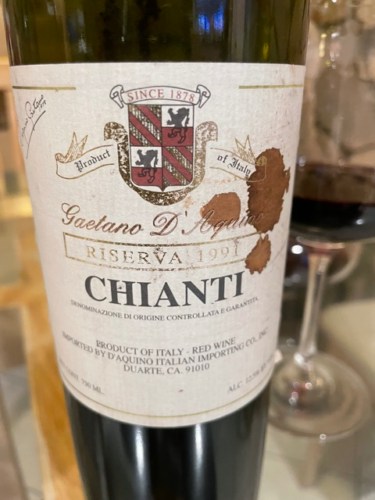
In order to click on bottle in this screenshot , I will do `click(169, 465)`.